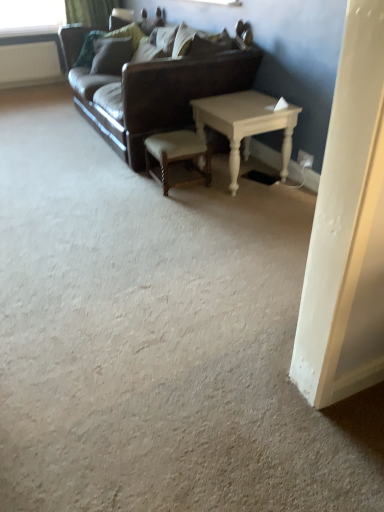
Question: Is velvet green pillow at upper center, acting as the 1th pillow starting from the back, behind white wood table at center?

Choices:
 (A) no
 (B) yes

Answer: (B)

Question: Considering the relative sizes of velvet green pillow at upper center, the 2th pillow from the right, and white wood table at center in the image provided, is velvet green pillow at upper center, the 2th pillow from the right, shorter than white wood table at center?

Choices:
 (A) no
 (B) yes

Answer: (B)

Question: Is velvet green pillow at upper center, acting as the 1th pillow starting from the back, positioned far away from white wood table at center?

Choices:
 (A) no
 (B) yes

Answer: (B)

Question: Is velvet green pillow at upper center, acting as the 1th pillow starting from the back, facing towards white wood table at center?

Choices:
 (A) no
 (B) yes

Answer: (A)

Question: Can we say velvet green pillow at upper center, the 2th pillow from the right, lies outside white wood table at center?

Choices:
 (A) yes
 (B) no

Answer: (A)

Question: Is velvet green pillow at upper center, acting as the 1th pillow starting from the back, thinner than white wood table at center?

Choices:
 (A) yes
 (B) no

Answer: (A)

Question: Does leather couch at center have a lesser width compared to white wood table at center?

Choices:
 (A) yes
 (B) no

Answer: (B)

Question: Are leather couch at center and white wood table at center far apart?

Choices:
 (A) no
 (B) yes

Answer: (A)

Question: Is leather couch at center positioned before white wood table at center?

Choices:
 (A) yes
 (B) no

Answer: (A)

Question: From a real-world perspective, is leather couch at center on top of white wood table at center?

Choices:
 (A) yes
 (B) no

Answer: (A)

Question: Does leather couch at center appear on the left side of white wood table at center?

Choices:
 (A) yes
 (B) no

Answer: (A)

Question: Does leather couch at center have a greater width compared to white wood table at center?

Choices:
 (A) yes
 (B) no

Answer: (A)

Question: Are white wood table at center and leather couch at center making contact?

Choices:
 (A) no
 (B) yes

Answer: (A)